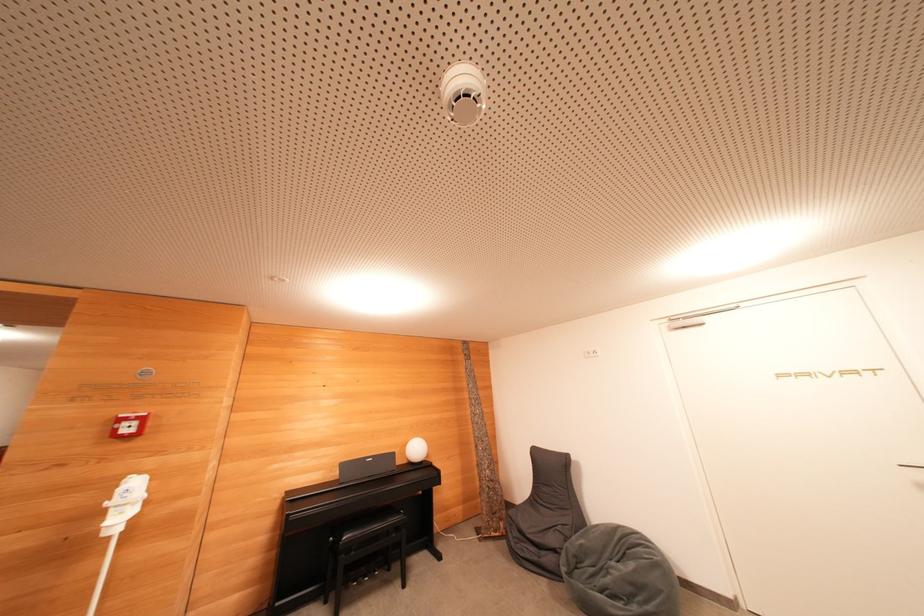
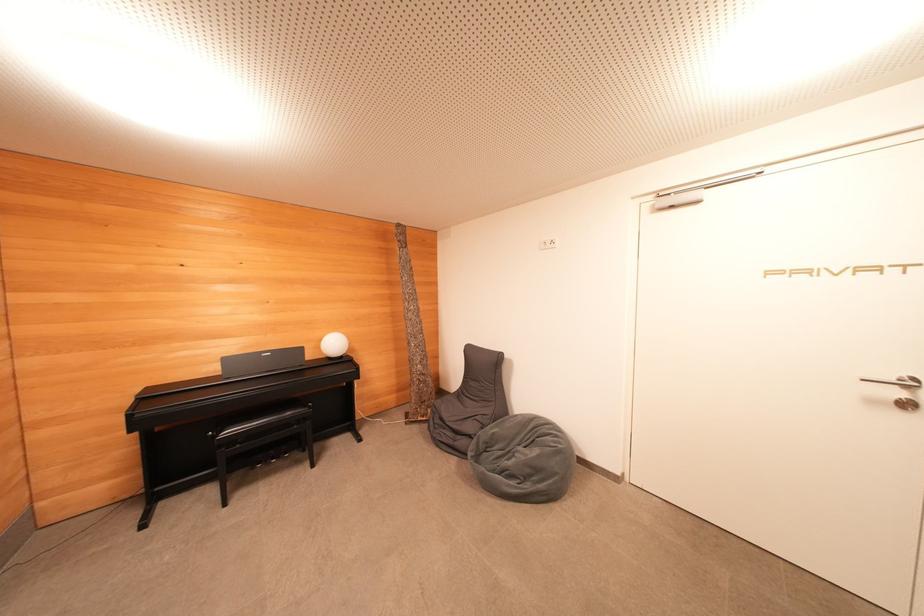
Find the pixel in the second image that matches (x=419, y=453) in the first image.

(337, 347)